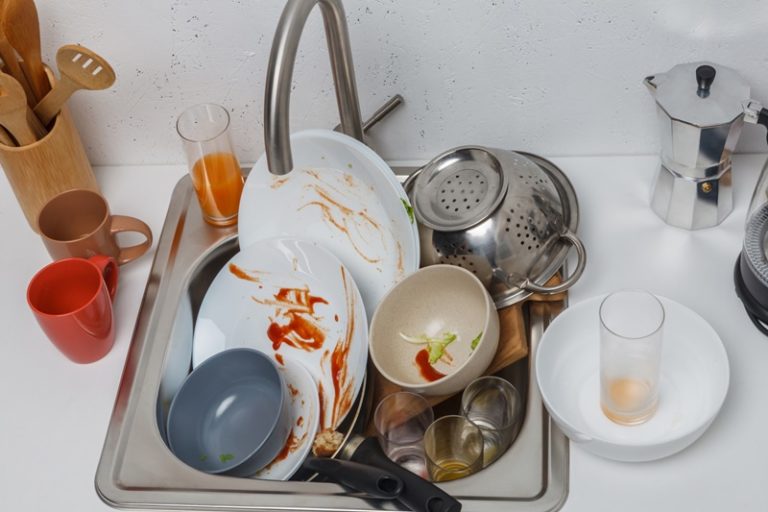
Identify the location of dirty dishes. (341, 183), (313, 287), (300, 396), (242, 402), (438, 324).